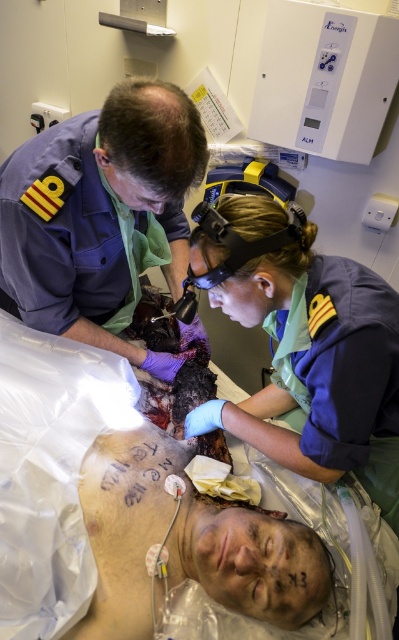
You are a security guard in the morgue. You need to check the access logs to see who entered the room first between the blue uniform at center and the purple uniform at upper left. Based on their positions in the image, can you determine which uniform was positioned closer to the entrance?

The purple uniform at upper left is closer to the entrance because the blue uniform at center is positioned on the right side of it, implying the purple uniform is near the entrance where they would have entered from.

You are an observer in a morgue and notice two people in uniforms. The blue uniform at center and the purple uniform at upper left are both present. Which uniform is narrower in width?

The blue uniform at center is narrower in width than the purple uniform at upper left.

You are a security guard in the morgue and need to identify which staff member is closer to the deceased body. Based on the scene, which of the two individuals, the blue uniform at center or the purple uniform at upper left, is nearer to the body?

The blue uniform at center is nearer to the deceased body because it is positioned closer to the center where the body is located, while the purple uniform at upper left is positioned further away in the upper left area.